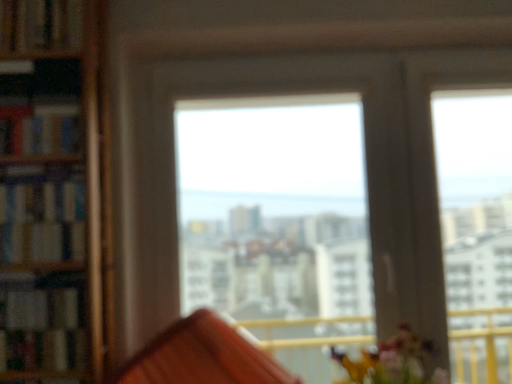
Question: Is hardcover book at upper left, the 1th book viewed from the top, located outside wooden bookshelf at left, the first book in the bottom-to-top sequence?

Choices:
 (A) yes
 (B) no

Answer: (A)

Question: From a real-world perspective, does hardcover book at upper left, the 1th book viewed from the top, sit lower than wooden bookshelf at left, which is the 4th book in top-to-bottom order?

Choices:
 (A) yes
 (B) no

Answer: (B)

Question: From the image's perspective, does hardcover book at upper left, the 1th book viewed from the top, appear lower than wooden bookshelf at left, which is the 4th book in top-to-bottom order?

Choices:
 (A) no
 (B) yes

Answer: (A)

Question: Considering the relative sizes of hardcover book at upper left, marked as the fourth book in a bottom-to-top arrangement, and wooden bookshelf at left, the first book in the bottom-to-top sequence, in the image provided, is hardcover book at upper left, marked as the fourth book in a bottom-to-top arrangement, wider than wooden bookshelf at left, the first book in the bottom-to-top sequence,?

Choices:
 (A) no
 (B) yes

Answer: (A)

Question: From the image's perspective, is hardcover book at upper left, the 1th book viewed from the top, on top of wooden bookshelf at left, the first book in the bottom-to-top sequence?

Choices:
 (A) yes
 (B) no

Answer: (A)

Question: In terms of size, does transparent glass window at center appear bigger or smaller than hardcover book at left, positioned as the 3th book in top-to-bottom order?

Choices:
 (A) big
 (B) small

Answer: (A)

Question: From a real-world perspective, is transparent glass window at center positioned above or below hardcover book at left, positioned as the 2th book in bottom-to-top order?

Choices:
 (A) below
 (B) above

Answer: (A)

Question: In terms of width, does transparent glass window at center look wider or thinner when compared to hardcover book at left, positioned as the 3th book in top-to-bottom order?

Choices:
 (A) thin
 (B) wide

Answer: (A)

Question: Would you say transparent glass window at center is to the left or to the right of hardcover book at left, positioned as the 3th book in top-to-bottom order, in the picture?

Choices:
 (A) right
 (B) left

Answer: (A)

Question: From a real-world perspective, is hardcover book at left, which is the 3th book from bottom to top, physically located above or below hardcover book at upper left, the 1th book viewed from the top?

Choices:
 (A) below
 (B) above

Answer: (A)

Question: Does point (59, 114) appear closer or farther from the camera than point (47, 39)?

Choices:
 (A) closer
 (B) farther

Answer: (A)

Question: Visually, is hardcover book at left, which is the second book from top to bottom, positioned to the left or to the right of hardcover book at upper left, the 1th book viewed from the top?

Choices:
 (A) left
 (B) right

Answer: (B)

Question: Would you say hardcover book at left, which is the second book from top to bottom, is inside or outside hardcover book at upper left, the 1th book viewed from the top?

Choices:
 (A) inside
 (B) outside

Answer: (B)

Question: In terms of height, does hardcover book at upper left, marked as the fourth book in a bottom-to-top arrangement, look taller or shorter compared to hardcover book at left, which is the second book from top to bottom?

Choices:
 (A) tall
 (B) short

Answer: (B)

Question: Based on their sizes in the image, would you say hardcover book at upper left, marked as the fourth book in a bottom-to-top arrangement, is bigger or smaller than hardcover book at left, which is the second book from top to bottom?

Choices:
 (A) small
 (B) big

Answer: (A)